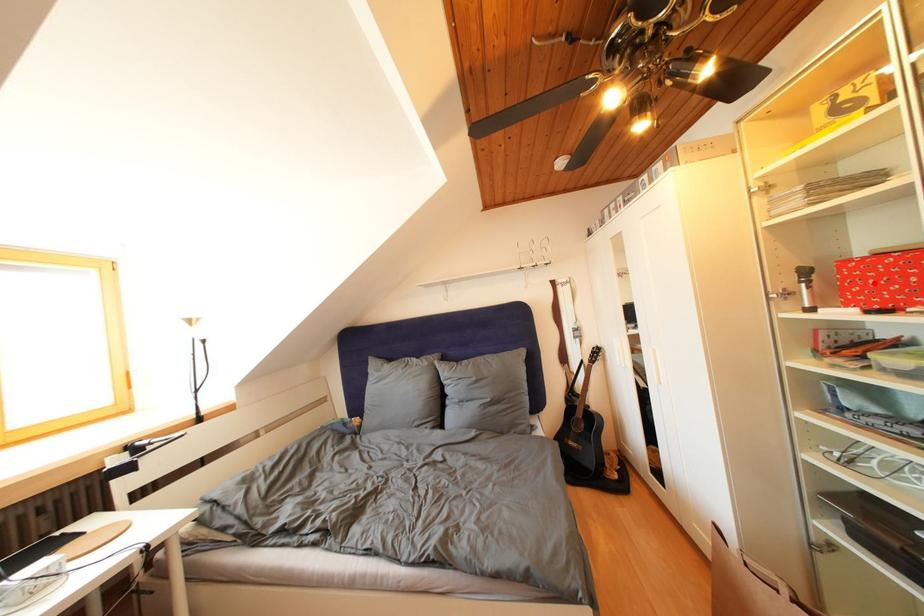
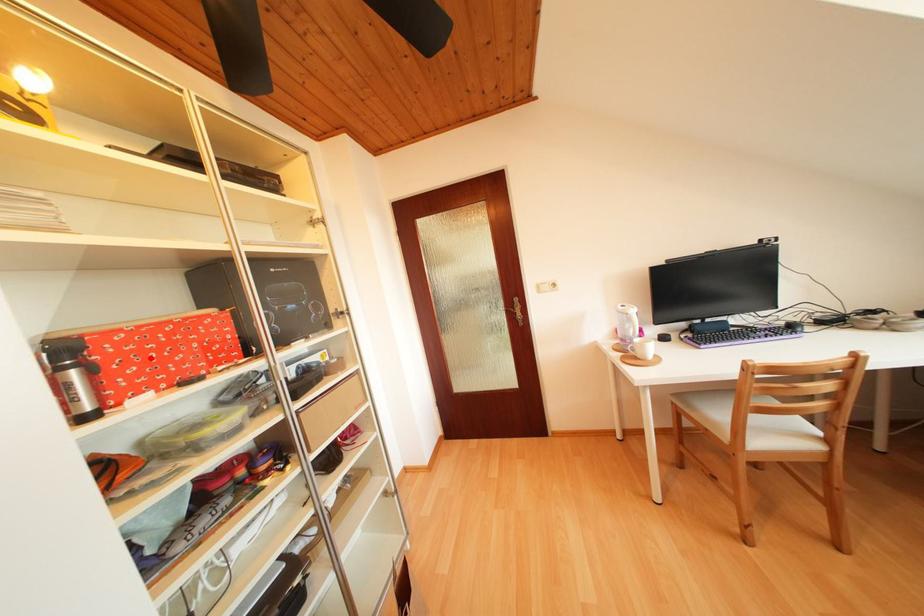
I am providing you with two images of the same scene from different viewpoints. A red point is marked on the first image and another point is marked on the second image. Does the point marked in image1 correspond to the same location as the one in image2?

Yes